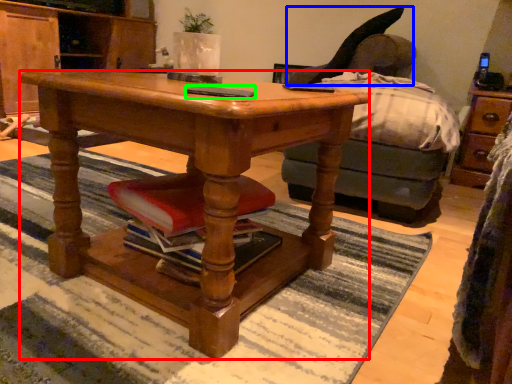
Question: Which object is the farthest from desk (highlighted by a red box)? Choose among these: swivel chair (highlighted by a blue box) or mobile phone (highlighted by a green box).

Choices:
 (A) swivel chair
 (B) mobile phone

Answer: (A)